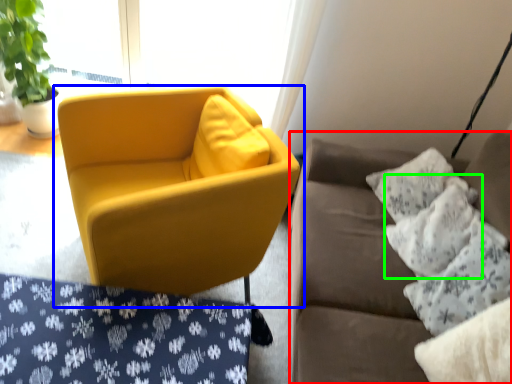
Question: Which object is the closest to the studio couch (highlighted by a red box)? Choose among these: chair (highlighted by a blue box) or pillow (highlighted by a green box).

Choices:
 (A) chair
 (B) pillow

Answer: (B)